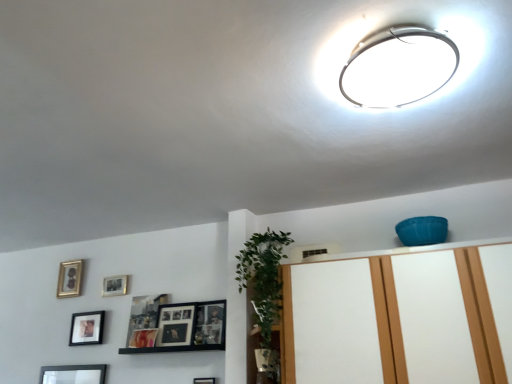
Question: Is green leafy plant at center bigger or smaller than matte black picture frame at center left, which is counted as the fourth picture frame, starting from the back?

Choices:
 (A) big
 (B) small

Answer: (A)

Question: From a real-world perspective, is green leafy plant at center physically located above or below matte black picture frame at center left, the second picture frame from the front?

Choices:
 (A) above
 (B) below

Answer: (A)

Question: Estimate the real-world distances between objects in this image. Which object is closer to the matte black picture frame at upper left, marked as the third picture frame in a left-to-right arrangement?

Choices:
 (A) gold metallic picture frame at upper left, which is the 1th picture frame from back to front
 (B) white glossy ceiling light at upper center
 (C) black matte picture frame at lower left, the fourth picture frame in the right-to-left sequence
 (D) white glossy dresser at upper center
 (E) green leafy plant at center

Answer: (C)

Question: Estimate the real-world distances between objects in this image. Which object is closer to the white glossy ceiling light at upper center?

Choices:
 (A) gold metallic picture frame at upper left, the 5th picture frame from the right
 (B) green leafy plant at center
 (C) matte black picture frame at upper left, the 3th picture frame from the right
 (D) black matte picture frame at lower left, which is counted as the 2th picture frame, starting from the left
 (E) white glossy dresser at upper center

Answer: (E)